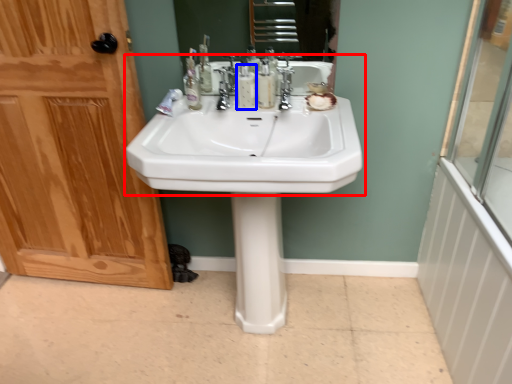
Question: Which point is further to the camera, sink (highlighted by a red box) or mouthwash (highlighted by a blue box)?

Choices:
 (A) sink
 (B) mouthwash

Answer: (B)